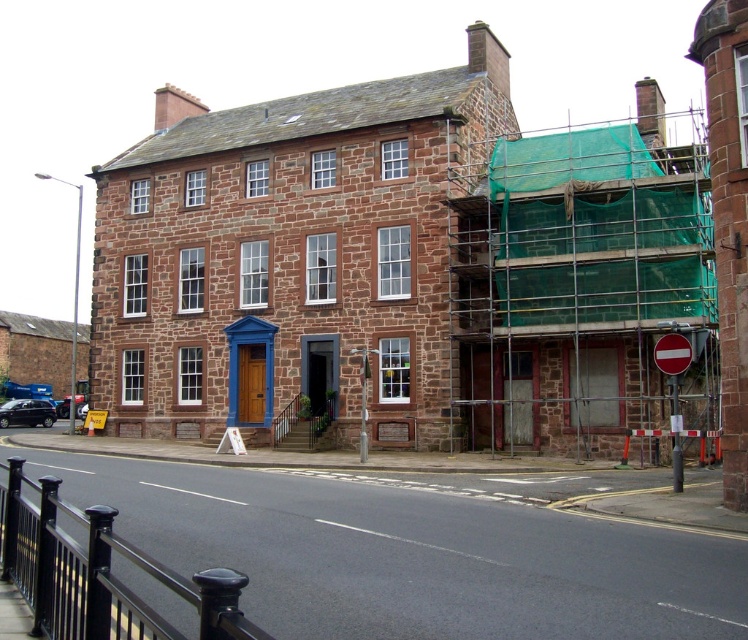
You are a delivery driver approaching the intersection near the three story stone building. You see a red plastic sign at lower right and a red glossy stop sign at center right. Which of these two signs is narrower?

The red plastic sign at lower right is narrower than the red glossy stop sign at center right.

You are standing at the corner of the street facing the three story stone building. You need to walk to the entrance which is at the ground floor blue painted door. Is the green mesh scaffolding at right blocking your path to the entrance?

The green mesh scaffolding at right is located at point (579, 284), which is to the right side of the building and does not block the path to the entrance on the ground floor. Therefore, the scaffolding is not in the way of reaching the blue painted door.